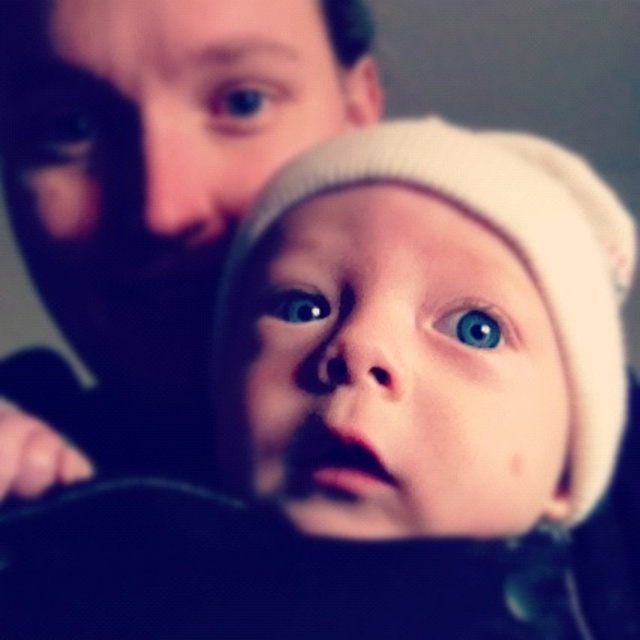
Question: Does matte black eye at upper left have a larger size compared to blue glossy eye at center?

Choices:
 (A) yes
 (B) no

Answer: (A)

Question: Among these points, which one is nearest to the camera?

Choices:
 (A) (477, 316)
 (B) (237, 124)
 (C) (44, 436)
 (D) (44, 129)

Answer: (A)

Question: Which of these objects is positioned closest to the matte black eye at upper left?

Choices:
 (A) matte black face at upper left
 (B) blue glossy eye at center

Answer: (A)

Question: Is matte black face at upper left in front of blue glossy eye at center?

Choices:
 (A) yes
 (B) no

Answer: (A)

Question: Is matte black face at upper left smaller than blue matte eye at center?

Choices:
 (A) yes
 (B) no

Answer: (B)

Question: Among these objects, which one is farthest from the camera?

Choices:
 (A) blue matte eye at upper center
 (B) matte black eye at upper left

Answer: (B)